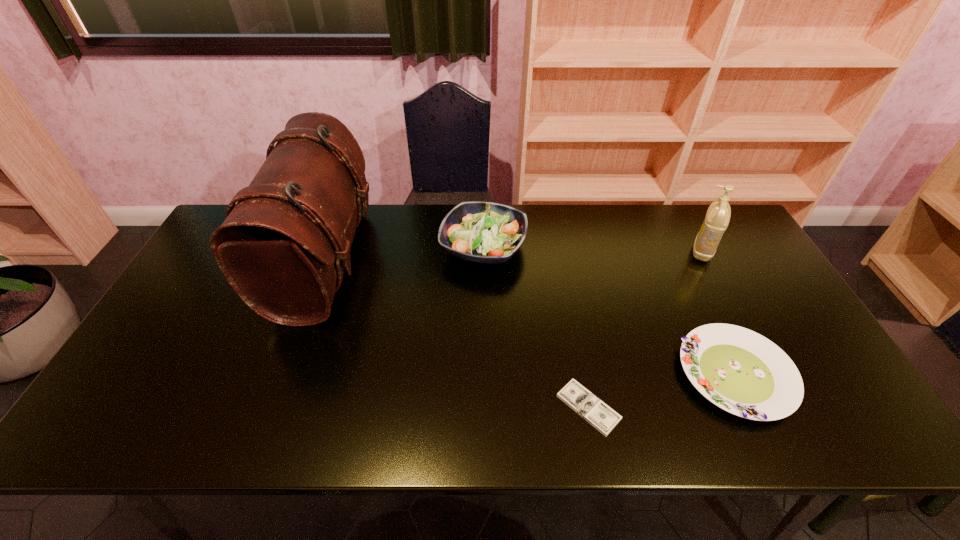
Image resolution: width=960 pixels, height=540 pixels. I want to click on empty space that is in between the dollar and the satchel, so click(457, 334).

This screenshot has width=960, height=540. I want to click on unoccupied area between the right salad plate and the detergent, so click(719, 313).

Locate an element on the screen. This screenshot has width=960, height=540. vacant space that's between the dollar and the satchel is located at coordinates (457, 334).

Find the location of a particular element. Image resolution: width=960 pixels, height=540 pixels. vacant area that lies between the detergent and the dollar is located at coordinates click(645, 329).

The width and height of the screenshot is (960, 540). In order to click on vacant space that's between the shortest object and the second tallest object in this screenshot , I will do click(645, 329).

Locate an element on the screen. The image size is (960, 540). unoccupied area between the detergent and the shorter salad plate is located at coordinates (719, 313).

Identify the location of the second closest object to the dollar. This screenshot has width=960, height=540. (483, 232).

This screenshot has width=960, height=540. What are the coordinates of `object that stands as the third closest to the leftmost object` in the screenshot? It's located at (742, 372).

Identify the location of vacant space that satisfies the following two spatial constraints: 1. on the back side of the dollar; 2. on the front-facing side of the satchel. (561, 261).

Find the location of `free space that satisfies the following two spatial constraints: 1. on the back side of the fourth shortest object; 2. on the right side of the right salad plate`. free space that satisfies the following two spatial constraints: 1. on the back side of the fourth shortest object; 2. on the right side of the right salad plate is located at coordinates (677, 251).